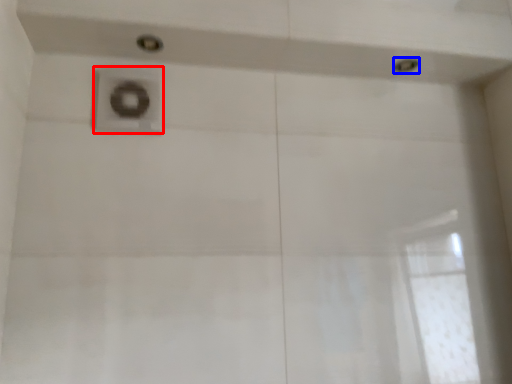
Question: Among these objects, which one is farthest to the camera, plumbing fixture (highlighted by a red box) or shower (highlighted by a blue box)?

Choices:
 (A) plumbing fixture
 (B) shower

Answer: (B)